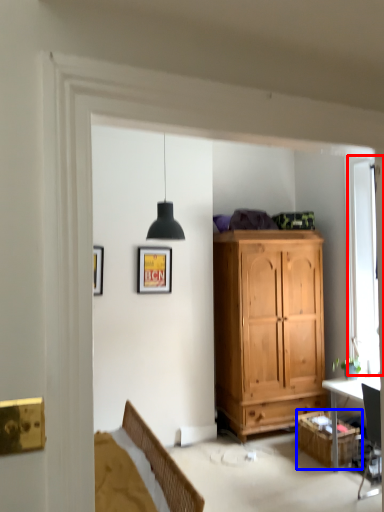
Question: Which object appears closest to the camera in this image, window (highlighted by a red box) or cabinetry (highlighted by a blue box)?

Choices:
 (A) window
 (B) cabinetry

Answer: (B)